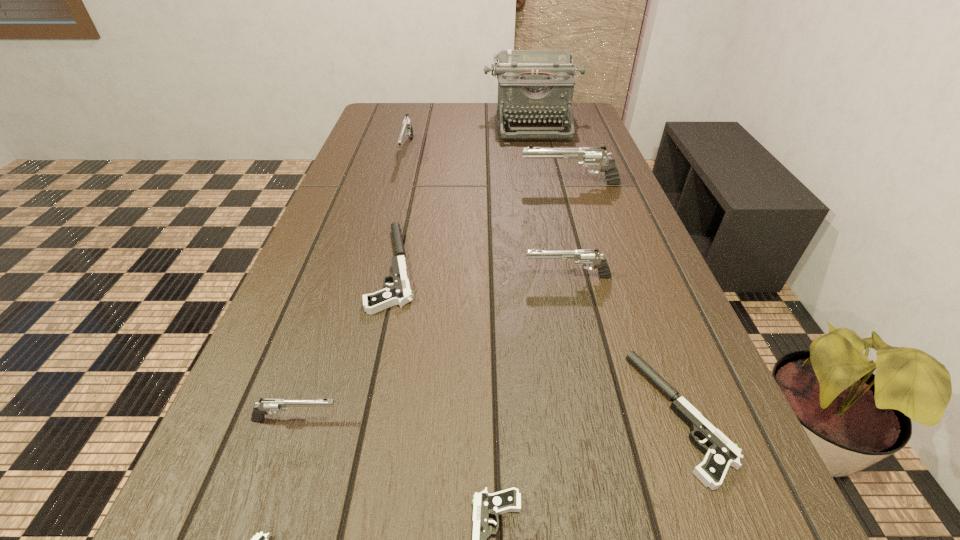
This screenshot has height=540, width=960. I want to click on vacant region located on the front-facing side of the third farthest silver pistol, so click(x=409, y=277).

I want to click on free space located on the front-facing side of the third farthest silver pistol, so click(x=347, y=277).

Where is `vacant region located on the front-facing side of the smallest silver pistol`? This screenshot has height=540, width=960. vacant region located on the front-facing side of the smallest silver pistol is located at coordinates (405, 420).

The height and width of the screenshot is (540, 960). Identify the location of vacant space located on the front-facing side of the sixth tallest pistol. (396, 415).

Find the location of a particular element. The height and width of the screenshot is (540, 960). free point located on the front-facing side of the sixth tallest pistol is located at coordinates coord(435,415).

At what (x,y) coordinates should I click in order to perform the action: click on free location located 0.380m on the front-facing side of the sixth tallest pistol. Please return your answer as a coordinate pair (x, y). This screenshot has height=540, width=960. Looking at the image, I should click on (396, 415).

Find the location of `object that is positioned at the far edge`. object that is positioned at the far edge is located at coordinates (534, 85).

Identify the location of typewriter that is at the right edge. (534, 85).

This screenshot has height=540, width=960. In order to click on object located at the far right corner in this screenshot , I will do `click(534, 85)`.

Locate an element on the screen. The width and height of the screenshot is (960, 540). vacant space at the left edge of the desktop is located at coordinates (275, 387).